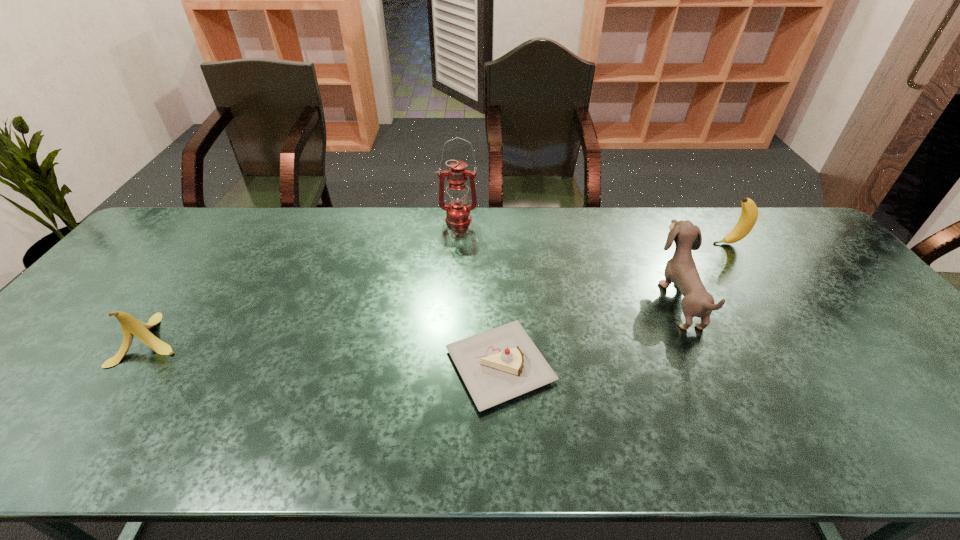
Locate an element on the screen. free space at the near edge of the desktop is located at coordinates (627, 456).

Find the location of a particular element. The image size is (960, 540). free space at the right edge of the desktop is located at coordinates (836, 289).

In the image, there is a desktop. In order to click on free space at the far left corner in this screenshot , I will do `click(195, 210)`.

At what (x,y) coordinates should I click in order to perform the action: click on vacant space at the near left corner of the desktop. Please return your answer as a coordinate pair (x, y). The width and height of the screenshot is (960, 540). Looking at the image, I should click on (14, 423).

Locate an element on the screen. free space between the taller banana and the oil lamp is located at coordinates pos(593,232).

Where is `free spot between the farther banana and the shortest object`? free spot between the farther banana and the shortest object is located at coordinates (614, 305).

What are the coordinates of `free point between the leftmost object and the oil lamp` in the screenshot? It's located at (305, 280).

Find the location of a particular element. This screenshot has height=540, width=960. unoccupied position between the shortest object and the right banana is located at coordinates (614, 305).

The image size is (960, 540). Identify the location of vacant area that lies between the nearer banana and the rightmost object. (441, 292).

Where is `blank region between the taller banana and the left banana`? blank region between the taller banana and the left banana is located at coordinates (441, 292).